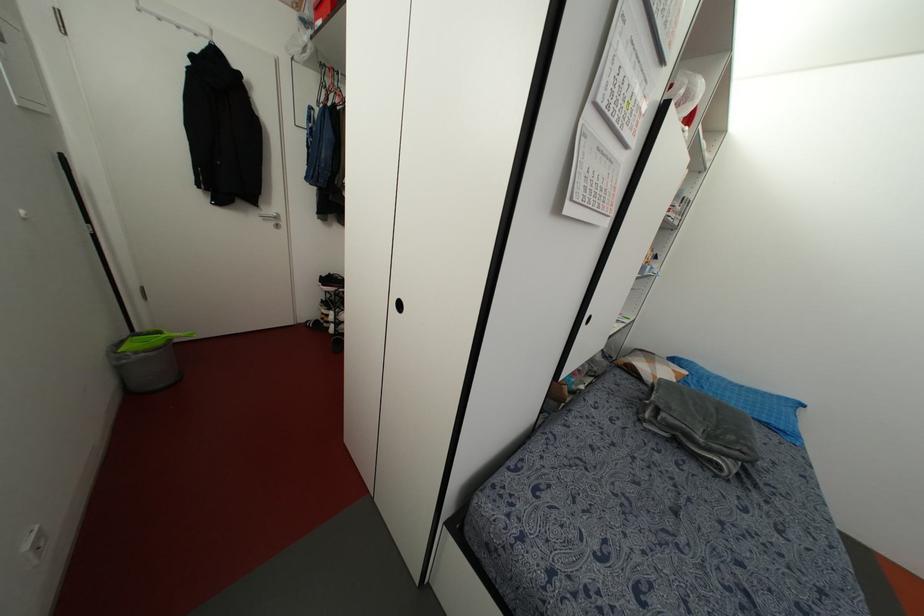
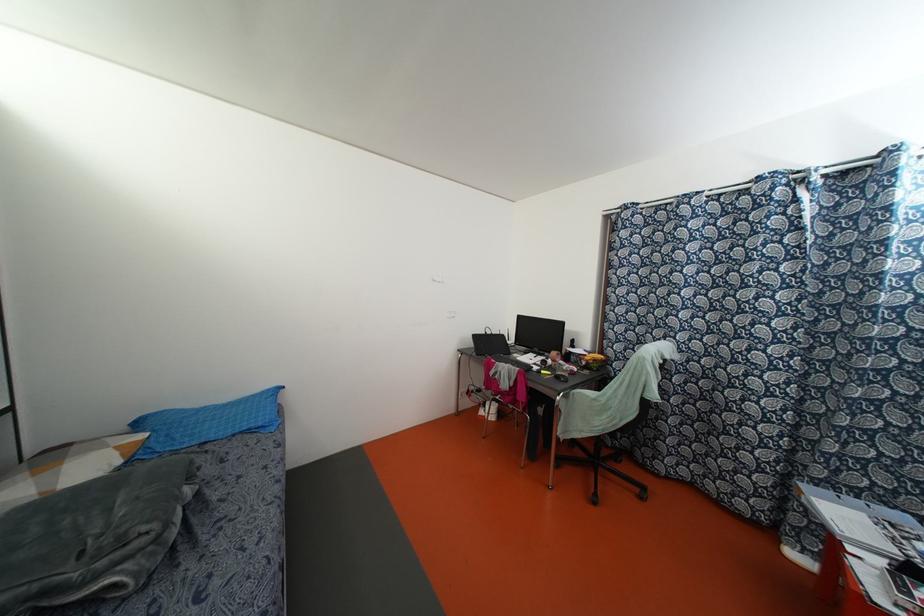
Locate, in the second image, the point that corresponds to [674,379] in the first image.

(118, 461)